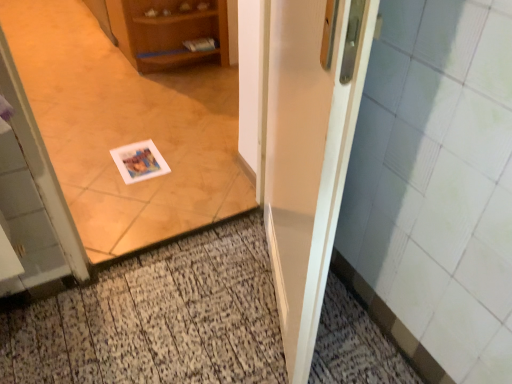
Locate an element on the screen. vacant area situated to the left side of white paper postcard at center is located at coordinates coord(94,166).